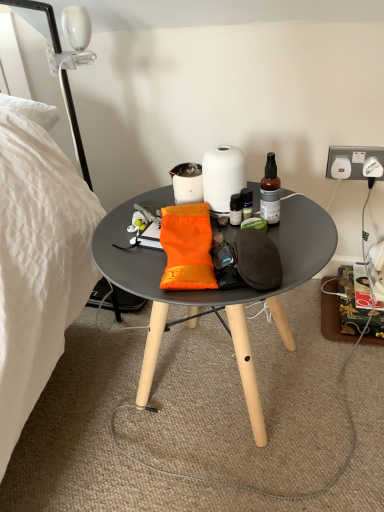
Find the location of a particular element. free point to the right of white matte paper towel at center is located at coordinates (300, 217).